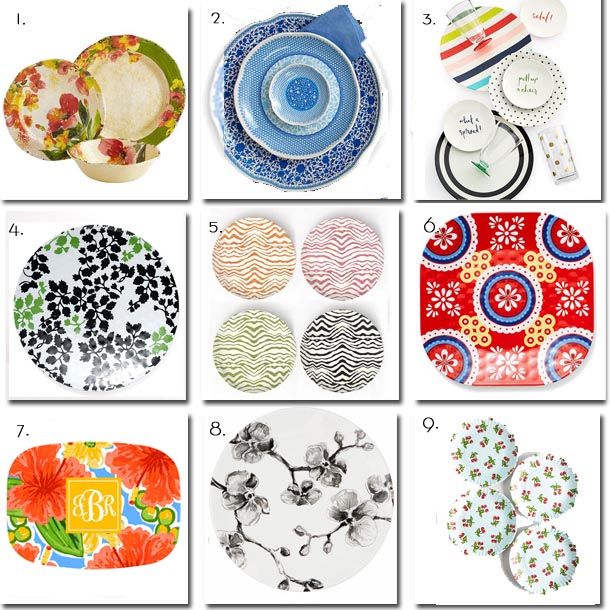
Where is `dark blue mosaic pattern dish`? This screenshot has height=610, width=610. dark blue mosaic pattern dish is located at coordinates (298, 178).